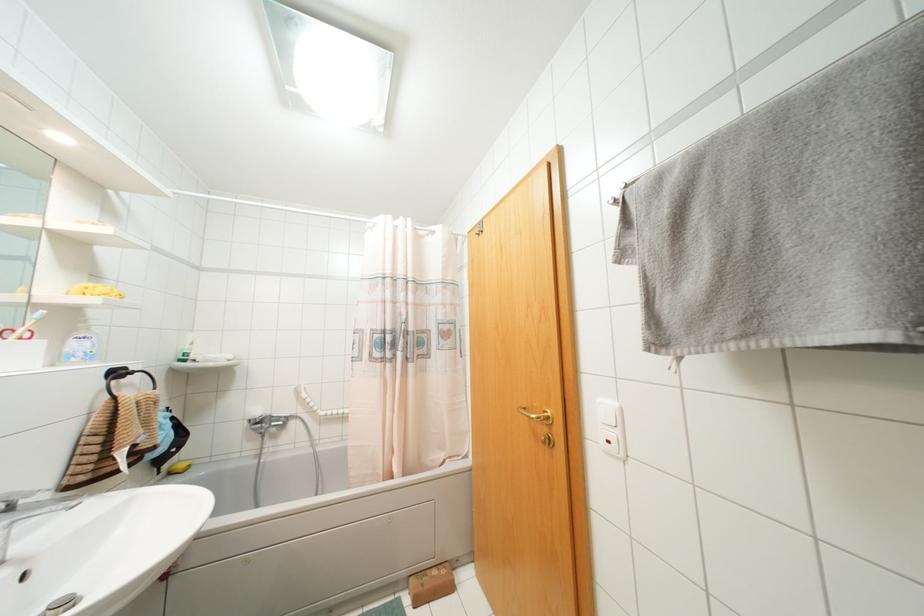
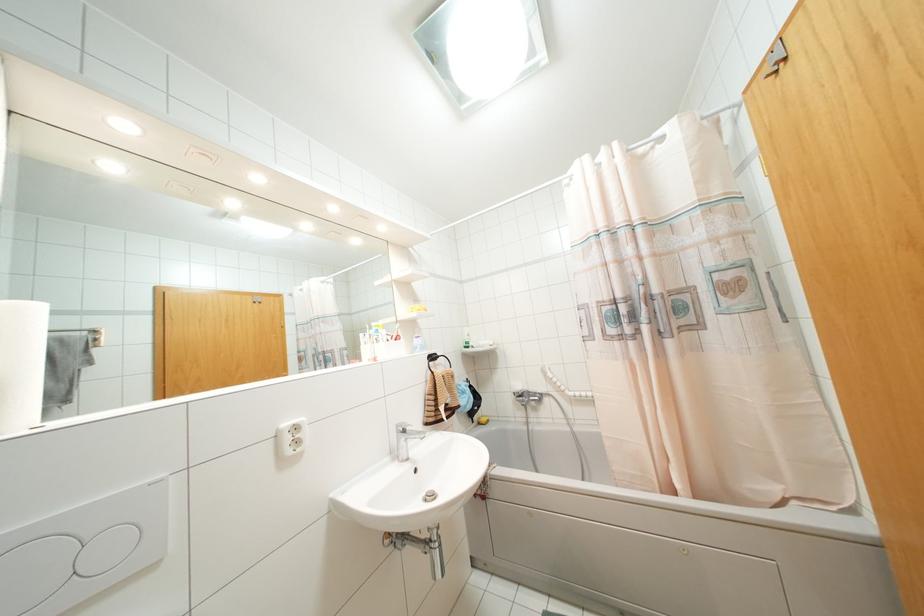
Find the pixel in the second image that matches point 261,428 in the first image.

(523, 400)